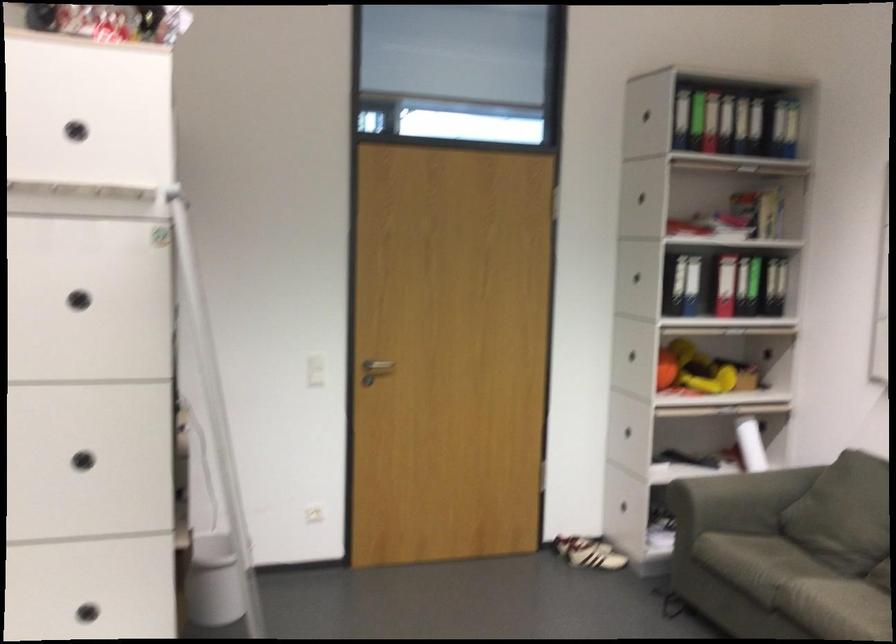
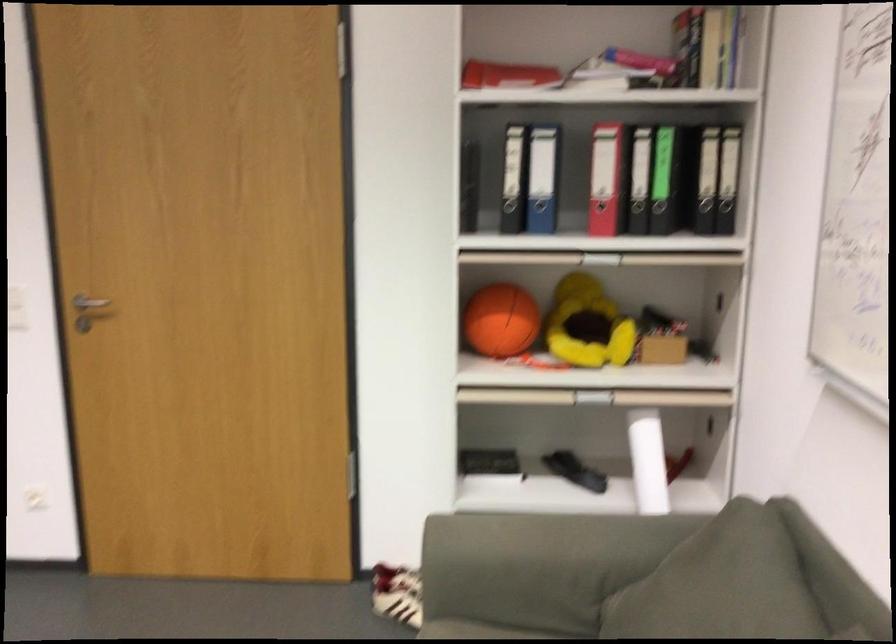
In the second image, find the point that corresponds to (340,354) in the first image.

(88, 305)